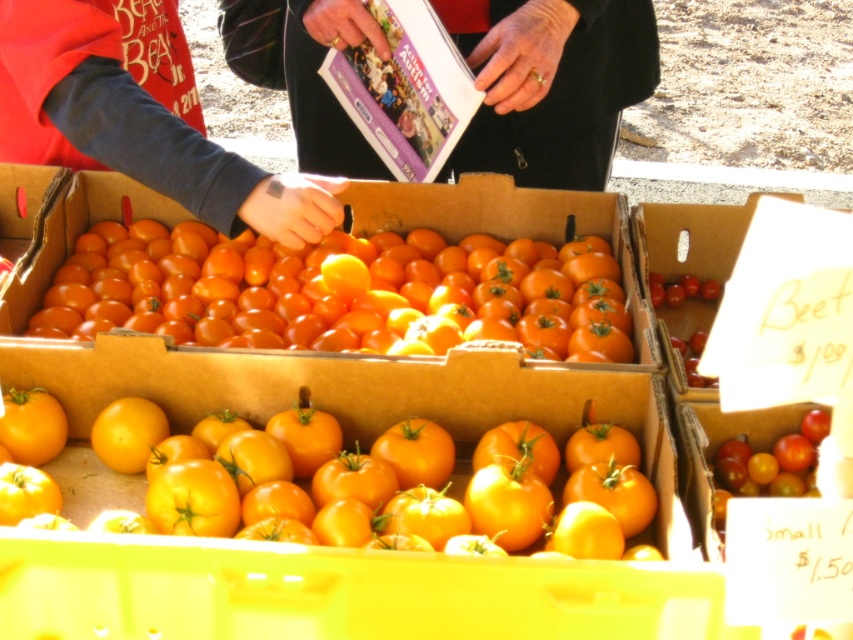
Question: Which point is closer to the camera?

Choices:
 (A) (41, 12)
 (B) (572, 129)
 (C) (544, 438)

Answer: (C)

Question: Considering the relative positions of smooth cardboard box at upper center and matte black jacket at upper left in the image provided, where is smooth cardboard box at upper center located with respect to matte black jacket at upper left?

Choices:
 (A) above
 (B) below

Answer: (A)

Question: Which point is farther to the camera?

Choices:
 (A) yellow matte tomato at center
 (B) matte black jacket at upper left
 (C) shiny orange tomato at center

Answer: (C)

Question: Which object appears farthest from the camera in this image?

Choices:
 (A) yellow matte tomato at center
 (B) matte black jacket at upper left

Answer: (B)

Question: Is yellow matte tomato at center bigger than smooth cardboard box at upper center?

Choices:
 (A) yes
 (B) no

Answer: (B)

Question: Can you confirm if smooth cardboard box at upper center is positioned below matte black jacket at upper left?

Choices:
 (A) no
 (B) yes

Answer: (A)